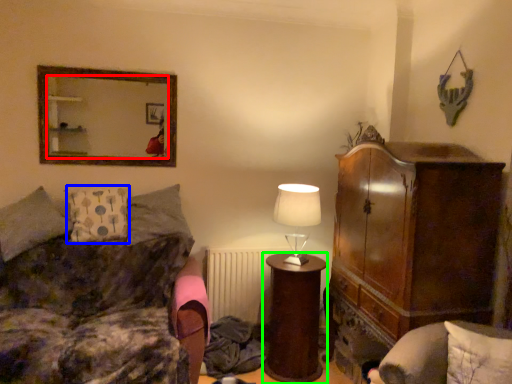
Question: Which object is positioned closest to mirror (highlighted by a red box)? Select from pillow (highlighted by a blue box) and desk (highlighted by a green box).

Choices:
 (A) pillow
 (B) desk

Answer: (A)